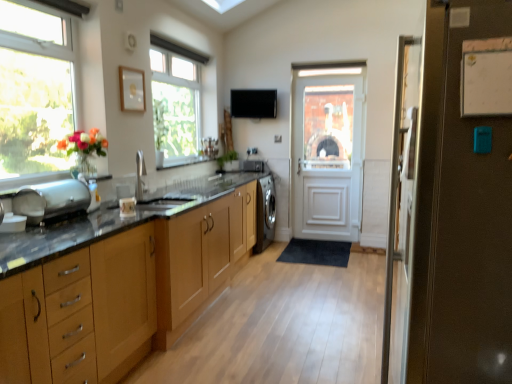
Describe the element at coordinates (51, 200) in the screenshot. I see `polished stainless steel bread bin at left, which is counted as the 2th appliance, starting from the right` at that location.

The image size is (512, 384). Describe the element at coordinates (486, 77) in the screenshot. I see `white paper at upper right` at that location.

What do you see at coordinates (200, 258) in the screenshot?
I see `wooden cabinets at center, placed as the first cabinetry when sorted from right to left` at bounding box center [200, 258].

The image size is (512, 384). I want to click on clear glass window at left, arranged as the first window when viewed from the front, so click(35, 92).

Find the location of a particular element. The height and width of the screenshot is (384, 512). brown matte refrigerator at right, the 1th door when ordered from front to back is located at coordinates (461, 212).

Is white wooden door at center, the first door in the back-to-front sequence, positioned beyond the bounds of black matte exhaust hood at upper center?

Yes, white wooden door at center, the first door in the back-to-front sequence, is located beyond the bounds of black matte exhaust hood at upper center.

Is white wooden door at center, which is counted as the 2th door, starting from the front, turned away from black matte exhaust hood at upper center?

No.

From a real-world perspective, which object rests below the other?

From a 3D spatial view, white wooden door at center, which is counted as the 2th door, starting from the front, is below.

Can you confirm if wooden cabinet at left, the 2th cabinetry positioned from the right, is bigger than white wooden door at center, which is counted as the 2th door, starting from the front?

Yes, wooden cabinet at left, the 2th cabinetry positioned from the right, is bigger than white wooden door at center, which is counted as the 2th door, starting from the front.

What's the angular difference between wooden cabinet at left, which ranks as the 1th cabinetry in front-to-back order, and white wooden door at center, the first door in the back-to-front sequence,'s facing directions?

The angular difference between wooden cabinet at left, which ranks as the 1th cabinetry in front-to-back order, and white wooden door at center, the first door in the back-to-front sequence, is 92 degrees.

Which object is wider, wooden cabinet at left, the 2th cabinetry positioned from the right, or white wooden door at center, the first door in the back-to-front sequence?

Wider between the two is wooden cabinet at left, the 2th cabinetry positioned from the right.

From a real-world perspective, is wooden cabinet at left, which ranks as the 1th cabinetry in left-to-right order, positioned above or below white wooden door at center, which is counted as the 2th door, starting from the front?

Clearly, from a real-world perspective, wooden cabinet at left, which ranks as the 1th cabinetry in left-to-right order, is below white wooden door at center, which is counted as the 2th door, starting from the front.

Based on their positions, is clear glass window at upper center, which ranks as the first window in back-to-front order, located to the left or right of white paper at upper right?

clear glass window at upper center, which ranks as the first window in back-to-front order, is to the left of white paper at upper right.

Between clear glass window at upper center, the 2th window when ordered from front to back, and white paper at upper right, which one has smaller size?

With smaller size is white paper at upper right.

Which object is thinner, clear glass window at upper center, the 2th window when ordered from front to back, or white paper at upper right?

white paper at upper right.

Based on the photo, can we say clear glass window at upper center, the first window when ordered from right to left, lies outside white paper at upper right?

That's correct, clear glass window at upper center, the first window when ordered from right to left, is outside of white paper at upper right.

Can we say white paper at upper right lies outside polished stainless steel bread bin at left, arranged as the first appliance when viewed from the left?

Absolutely, white paper at upper right is external to polished stainless steel bread bin at left, arranged as the first appliance when viewed from the left.

Does white paper at upper right turn towards polished stainless steel bread bin at left, arranged as the first appliance when viewed from the left?

No, white paper at upper right is not oriented towards polished stainless steel bread bin at left, arranged as the first appliance when viewed from the left.

How much distance is there between white paper at upper right and polished stainless steel bread bin at left, acting as the second appliance starting from the back?

white paper at upper right is 6.95 feet from polished stainless steel bread bin at left, acting as the second appliance starting from the back.

Looking at this image, is white paper at upper right behind polished stainless steel bread bin at left, the 1th appliance in the bottom-to-top sequence?

No, it is in front of polished stainless steel bread bin at left, the 1th appliance in the bottom-to-top sequence.

Is brown matte refrigerator at right, the 1th door when ordered from front to back, located outside white paper at upper right?

Absolutely, brown matte refrigerator at right, the 1th door when ordered from front to back, is external to white paper at upper right.

Is brown matte refrigerator at right, the 1th door when ordered from front to back, shorter than white paper at upper right?

Incorrect, the height of brown matte refrigerator at right, the 1th door when ordered from front to back, does not fall short of that of white paper at upper right.

Is the depth of brown matte refrigerator at right, the 1th door when ordered from front to back, less than that of white paper at upper right?

Yes, the depth of brown matte refrigerator at right, the 1th door when ordered from front to back, is less than that of white paper at upper right.

Based on the photo, from the image's perspective, is brown matte refrigerator at right, which is the 2th door in back-to-front order, above or below white paper at upper right?

Clearly, from the image's perspective, brown matte refrigerator at right, which is the 2th door in back-to-front order, is below white paper at upper right.

Is satin black washing machine at center, which is counted as the 1th appliance, starting from the back, to the left of white wooden door at center, which is counted as the 2th door, starting from the front, from the viewer's perspective?

Indeed, satin black washing machine at center, which is counted as the 1th appliance, starting from the back, is positioned on the left side of white wooden door at center, which is counted as the 2th door, starting from the front.

Could you tell me if satin black washing machine at center, marked as the 2th appliance in a left-to-right arrangement, is turned towards white wooden door at center, the first door in the back-to-front sequence?

No, satin black washing machine at center, marked as the 2th appliance in a left-to-right arrangement, is not turned towards white wooden door at center, the first door in the back-to-front sequence.

Which of these two, satin black washing machine at center, which is counted as the 1th appliance, starting from the top, or white wooden door at center, which is counted as the 2th door, starting from the front, is smaller?

Smaller between the two is satin black washing machine at center, which is counted as the 1th appliance, starting from the top.

What's the angular difference between wooden cabinet at left, the 2th cabinetry when ordered from back to front, and wooden cabinets at center, which is counted as the 2th cabinetry, starting from the left,'s facing directions?

The angle between the facing direction of wooden cabinet at left, the 2th cabinetry when ordered from back to front, and the facing direction of wooden cabinets at center, which is counted as the 2th cabinetry, starting from the left, is 0.000878 degrees.

Considering the positions of objects wooden cabinet at left, which ranks as the 1th cabinetry in front-to-back order, and wooden cabinets at center, which appears as the 2th cabinetry when viewed from the front, in the image provided, who is behind, wooden cabinet at left, which ranks as the 1th cabinetry in front-to-back order, or wooden cabinets at center, which appears as the 2th cabinetry when viewed from the front,?

Positioned behind is wooden cabinets at center, which appears as the 2th cabinetry when viewed from the front.

Are wooden cabinet at left, the 2th cabinetry positioned from the right, and wooden cabinets at center, which is counted as the 2th cabinetry, starting from the left, far apart?

No, there isn't a large distance between wooden cabinet at left, the 2th cabinetry positioned from the right, and wooden cabinets at center, which is counted as the 2th cabinetry, starting from the left.

You are a GUI agent. You are given a task and a screenshot of the screen. Output one action in this format:
    pyautogui.click(x=<x>, y=<y>)
    Task: Click on the door that is the 1st one below the black matte exhaust hood at upper center (from a real-world perspective)
    
    Given the screenshot: What is the action you would take?
    click(x=326, y=152)

What are the coordinates of `door that appears behind the wooden cabinet at left, the 2th cabinetry when ordered from back to front` in the screenshot? It's located at (326, 152).

Considering their positions, is satin black washing machine at center, the second appliance positioned from the front, positioned further to clear glass window at upper center, the 2th window when ordered from front to back, than clear glass window at left, positioned as the first window in left-to-right order?

Among the two, clear glass window at left, positioned as the first window in left-to-right order, is located further to clear glass window at upper center, the 2th window when ordered from front to back.

Consider the image. When comparing their distances from satin black washing machine at center, which is counted as the 1th appliance, starting from the back, does clear glass window at left, arranged as the 2th window when viewed from the right, or wooden cabinets at center, which is counted as the 2th cabinetry, starting from the left, seem closer?

wooden cabinets at center, which is counted as the 2th cabinetry, starting from the left, lies closer to satin black washing machine at center, which is counted as the 1th appliance, starting from the back, than the other object.

Which object lies nearer to the anchor point wooden cabinet at left, the 2th cabinetry positioned from the right, white wooden door at center, the first door in the back-to-front sequence, or brown matte refrigerator at right, the 1th door when ordered from front to back?

The object closer to wooden cabinet at left, the 2th cabinetry positioned from the right, is brown matte refrigerator at right, the 1th door when ordered from front to back.

Considering their positions, is white paper at upper right positioned closer to satin black washing machine at center, marked as the 2th appliance in a left-to-right arrangement, than wooden cabinets at center, positioned as the first cabinetry in back-to-front order?

wooden cabinets at center, positioned as the first cabinetry in back-to-front order, is closer to satin black washing machine at center, marked as the 2th appliance in a left-to-right arrangement.

Looking at the image, which one is located further to white wooden door at center, the first door in the back-to-front sequence, black matte exhaust hood at upper center or polished stainless steel bread bin at left, which is counted as the 2th appliance, starting from the right?

The object further to white wooden door at center, the first door in the back-to-front sequence, is polished stainless steel bread bin at left, which is counted as the 2th appliance, starting from the right.

Looking at the image, which one is located closer to polished stainless steel bread bin at left, which is counted as the 2th appliance, starting from the right, wooden cabinets at center, placed as the first cabinetry when sorted from right to left, or black matte exhaust hood at upper center?

wooden cabinets at center, placed as the first cabinetry when sorted from right to left, is closer to polished stainless steel bread bin at left, which is counted as the 2th appliance, starting from the right.

Considering their positions, is wooden cabinets at center, which appears as the 2th cabinetry when viewed from the front, positioned closer to polished stainless steel bread bin at left, arranged as the first appliance when viewed from the left, than brown matte refrigerator at right, the 1th door when ordered from front to back?

wooden cabinets at center, which appears as the 2th cabinetry when viewed from the front, is closer to polished stainless steel bread bin at left, arranged as the first appliance when viewed from the left.

From the image, which object appears to be farther from black matte exhaust hood at upper center, clear glass window at left, arranged as the 2th window when viewed from the right, or white paper at upper right?

white paper at upper right is further to black matte exhaust hood at upper center.

At what (x,y) coordinates should I click in order to perform the action: click on bulletin board located between brown matte refrigerator at right, which is the 2th door in back-to-front order, and wooden cabinets at center, positioned as the first cabinetry in back-to-front order, in the depth direction. Please return your answer as a coordinate pair (x, y). The height and width of the screenshot is (384, 512). Looking at the image, I should click on (486, 77).

At what (x,y) coordinates should I click in order to perform the action: click on exhaust hood situated between clear glass window at upper center, the second window when ordered from left to right, and white wooden door at center, which is counted as the 2th door, starting from the front, from left to right. Please return your answer as a coordinate pair (x, y). Looking at the image, I should click on (253, 103).

Where is `appliance positioned between white paper at upper right and clear glass window at upper center, the first window when ordered from right to left, from near to far`? The height and width of the screenshot is (384, 512). appliance positioned between white paper at upper right and clear glass window at upper center, the first window when ordered from right to left, from near to far is located at coordinates (51, 200).

What are the coordinates of `exhaust hood located between white paper at upper right and satin black washing machine at center, which is counted as the 1th appliance, starting from the top, in the depth direction` in the screenshot? It's located at (253, 103).